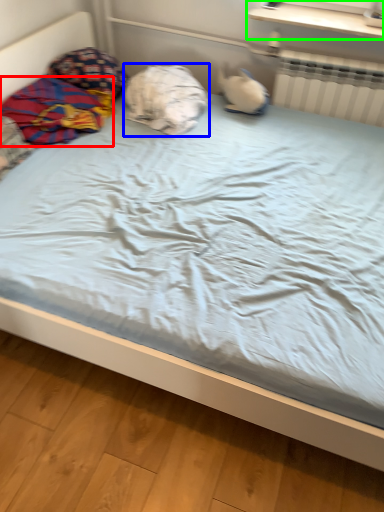
Question: Estimate the real-world distances between objects in this image. Which object is farther from material (highlighted by a red box), pillow (highlighted by a blue box) or window sill (highlighted by a green box)?

Choices:
 (A) pillow
 (B) window sill

Answer: (B)